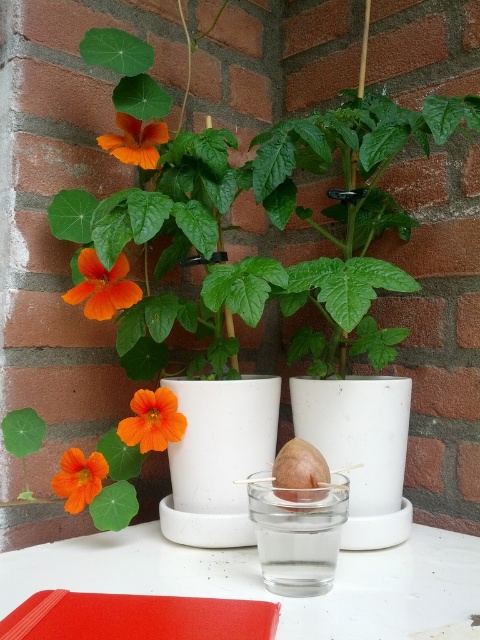
Question: Which point is farther from the camera taking this photo?

Choices:
 (A) (107, 316)
 (B) (80, 499)

Answer: (B)

Question: Which object is closer to the camera taking this photo?

Choices:
 (A) white glossy table at lower center
 (B) orange matte flower at left

Answer: (A)

Question: Does orange matte flower at center appear over orange matte flower at lower left?

Choices:
 (A) no
 (B) yes

Answer: (B)

Question: Does white glossy table at lower center have a smaller size compared to orange matte flower at upper left?

Choices:
 (A) yes
 (B) no

Answer: (B)

Question: Can you confirm if orange matte flower at lower left is positioned above orange matte flower at upper left?

Choices:
 (A) no
 (B) yes

Answer: (A)

Question: Estimate the real-world distances between objects in this image. Which object is farther from the orange matte flower at left?

Choices:
 (A) orange matte flower at lower left
 (B) orange matte flower at upper left

Answer: (A)